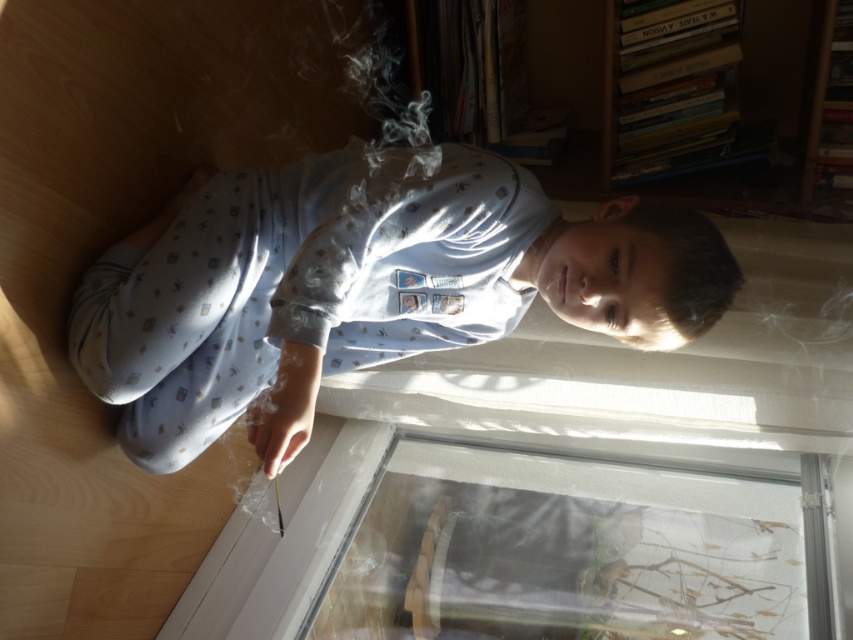
In the scene shown: You are a parent entering the room and see the light blue cotton pajamas at center and the wooden bookshelf at upper right. Based on their positions, can you determine which object is closer to the window?

The light blue cotton pajamas at center is located below the wooden bookshelf at upper right, so the wooden bookshelf at upper right is closer to the window since it is above the pajamas.

You are a delivery robot trying to reach the front door of the house. You are currently at the center of the room and see the transparent glass door at lower center. Can you move directly towards it without any obstacles in your path?

The transparent glass door at lower center is located at point (573, 550), so yes, you can move directly towards it without any obstacles in your path.

You are a parent checking on your child in the living room. You see the point at coordinates (x=363, y=288). What is the object located at that point?

The point at coordinates (x=363, y=288) indicates light blue cotton pajamas at center.